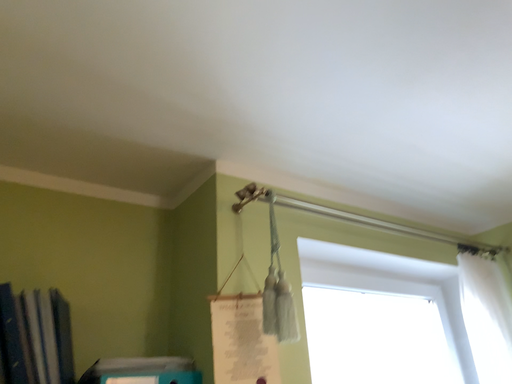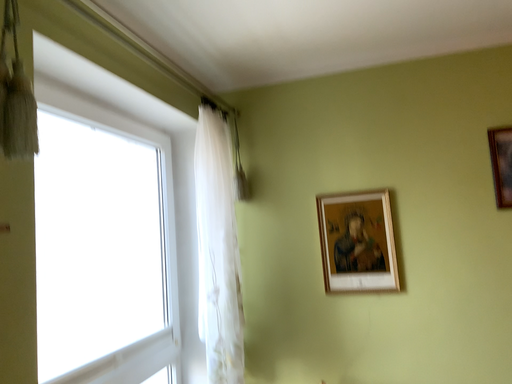
Question: Which way did the camera rotate in the video?

Choices:
 (A) rotated right
 (B) rotated left

Answer: (A)